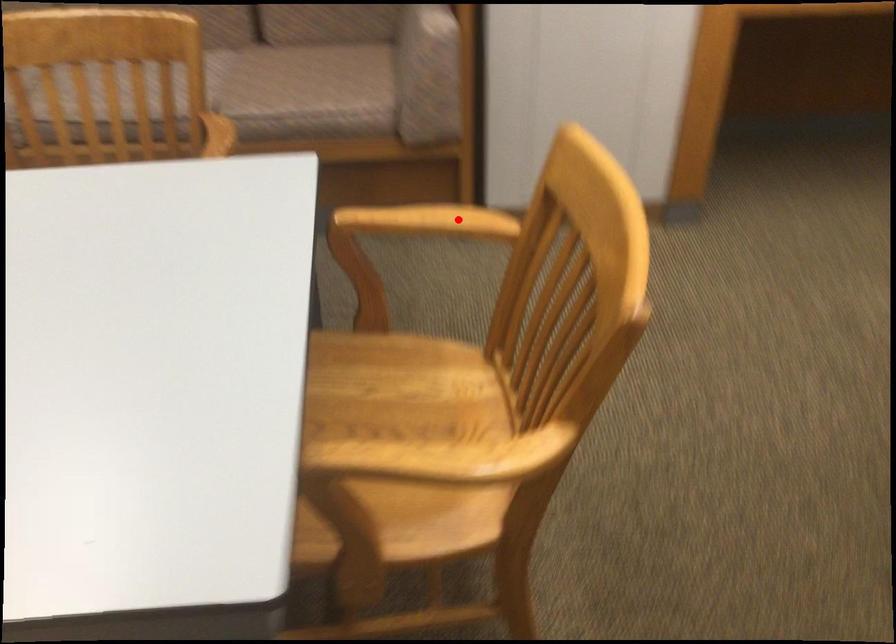
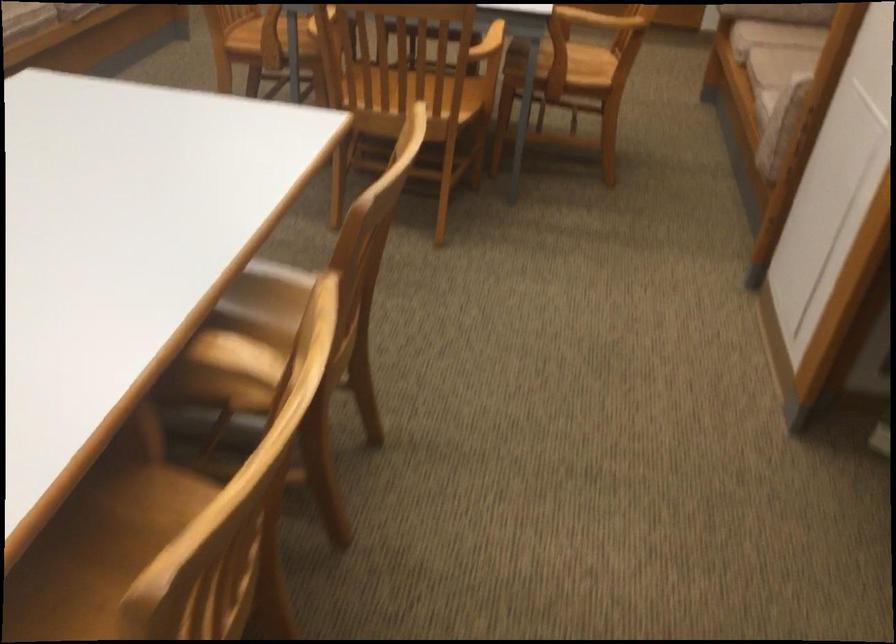
Question: I am providing you with two images of the same scene from different viewpoints. A red point is shown in image1. For the corresponding object point in image2, is it positioned nearer or farther from the camera?

Choices:
 (A) Nearer
 (B) Farther

Answer: (B)